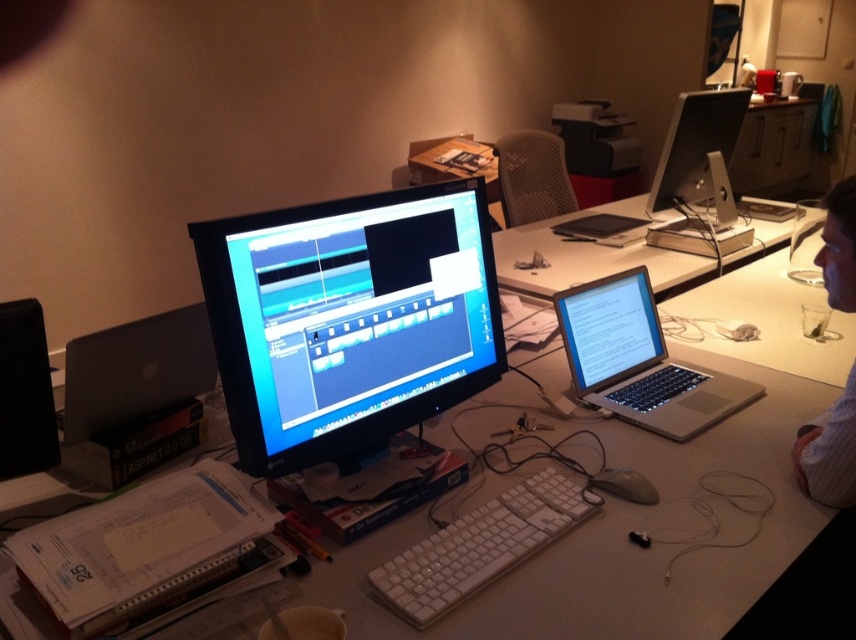
Question: Considering the real-world distances, which object is farthest from the white plastic keyboard at center?

Choices:
 (A) silver metallic laptop at center
 (B) white plastic table at center

Answer: (B)

Question: Which of the following is the farthest from the observer?

Choices:
 (A) white striped shirt at right
 (B) matte black monitor at center
 (C) white plastic keyboard at center
 (D) satin black monitor at upper right

Answer: (D)

Question: Observing the image, what is the correct spatial positioning of silver metallic laptop at center in reference to white plastic keyboard at center?

Choices:
 (A) above
 (B) below

Answer: (A)

Question: Does silver metallic laptop at center have a greater width compared to white plastic table at center?

Choices:
 (A) no
 (B) yes

Answer: (A)

Question: Does white plastic table at center appear under white plastic mouse at lower center?

Choices:
 (A) yes
 (B) no

Answer: (B)

Question: Estimate the real-world distances between objects in this image. Which object is closer to the matte black monitor at center?

Choices:
 (A) white striped shirt at right
 (B) satin black monitor at upper right

Answer: (A)